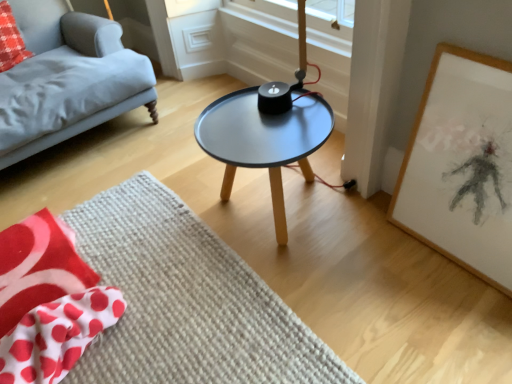
Where is `vacant space to the right of red polka dot fabric at lower left`? The height and width of the screenshot is (384, 512). vacant space to the right of red polka dot fabric at lower left is located at coordinates (170, 287).